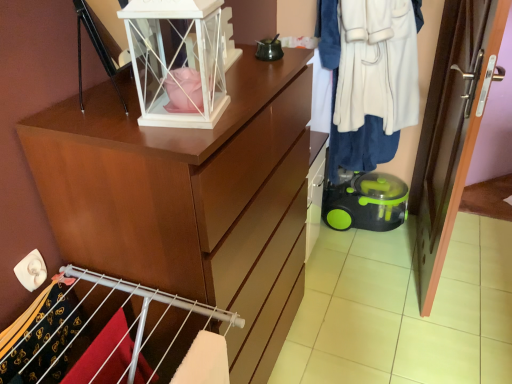
Question: From a real-world perspective, is white plush coat at right on green plastic vacuum cleaner at lower right?

Choices:
 (A) no
 (B) yes

Answer: (B)

Question: Considering the relative positions of white plush coat at right and green plastic vacuum cleaner at lower right in the image provided, is white plush coat at right to the left of green plastic vacuum cleaner at lower right from the viewer's perspective?

Choices:
 (A) yes
 (B) no

Answer: (A)

Question: Can we say white plush coat at right lies outside green plastic vacuum cleaner at lower right?

Choices:
 (A) no
 (B) yes

Answer: (B)

Question: From a real-world perspective, is white plush coat at right below green plastic vacuum cleaner at lower right?

Choices:
 (A) yes
 (B) no

Answer: (B)

Question: Can you confirm if white plush coat at right is thinner than green plastic vacuum cleaner at lower right?

Choices:
 (A) no
 (B) yes

Answer: (A)

Question: Can you confirm if white plush coat at right is bigger than green plastic vacuum cleaner at lower right?

Choices:
 (A) yes
 (B) no

Answer: (A)

Question: Can you confirm if green plastic vacuum cleaner at lower right is thinner than white plush coat at right?

Choices:
 (A) yes
 (B) no

Answer: (A)

Question: Does green plastic vacuum cleaner at lower right appear on the right side of white plush coat at right?

Choices:
 (A) no
 (B) yes

Answer: (B)

Question: Considering the relative sizes of green plastic vacuum cleaner at lower right and white plush coat at right in the image provided, is green plastic vacuum cleaner at lower right taller than white plush coat at right?

Choices:
 (A) yes
 (B) no

Answer: (B)

Question: Is green plastic vacuum cleaner at lower right wider than white plush coat at right?

Choices:
 (A) no
 (B) yes

Answer: (A)

Question: Would you say white plush coat at right is part of green plastic vacuum cleaner at lower right's contents?

Choices:
 (A) no
 (B) yes

Answer: (A)

Question: From a real-world perspective, is green plastic vacuum cleaner at lower right located beneath white plush coat at right?

Choices:
 (A) yes
 (B) no

Answer: (A)

Question: Based on their positions, is green plastic vacuum cleaner at lower right located to the left or right of white plush coat at right?

Choices:
 (A) right
 (B) left

Answer: (A)